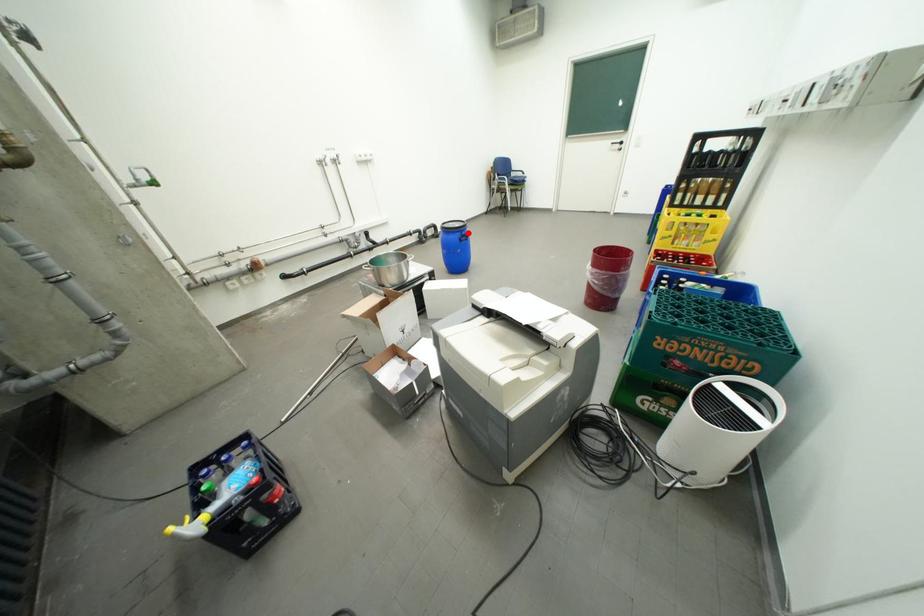
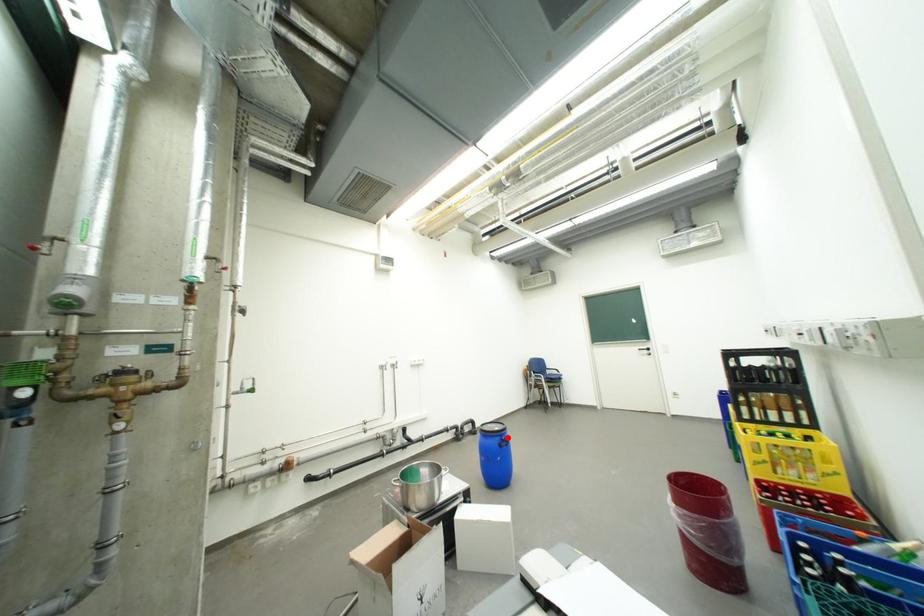
I am providing you with two images of the same scene from different viewpoints. A red point is marked on the first image and another point is marked on the second image. Is the marked point in image1 the same physical position as the marked point in image2?

Yes